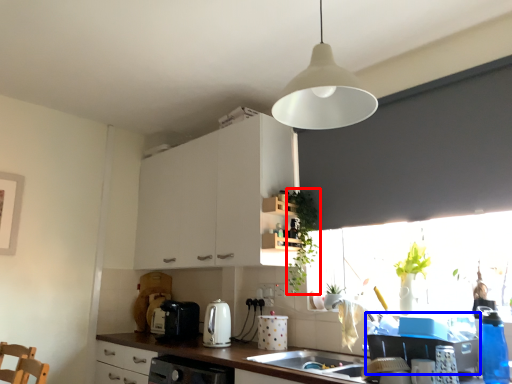
Question: Which object appears farthest to the camera in this image, plant (highlighted by a red box) or appliance (highlighted by a blue box)?

Choices:
 (A) plant
 (B) appliance

Answer: (A)